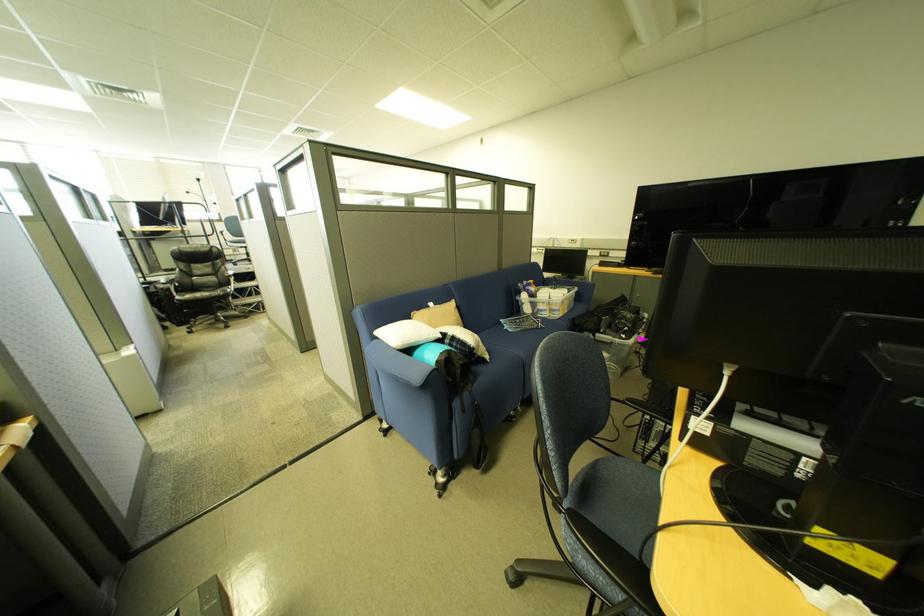
Find the location of a particular element. The height and width of the screenshot is (616, 924). black chair armrest is located at coordinates (615, 562).